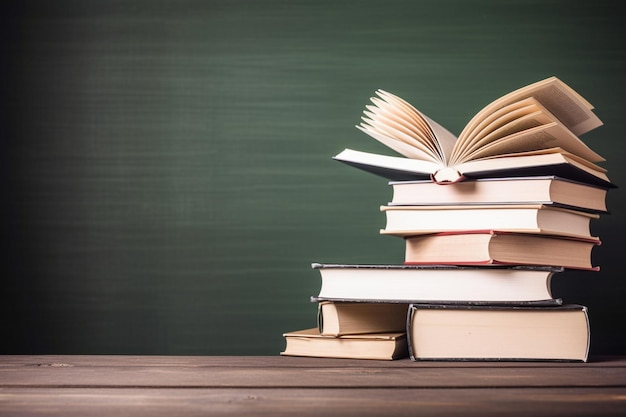
Where is `books`? books is located at coordinates (480, 341), (372, 349), (371, 319), (414, 283), (446, 248), (449, 218), (483, 193), (496, 158).